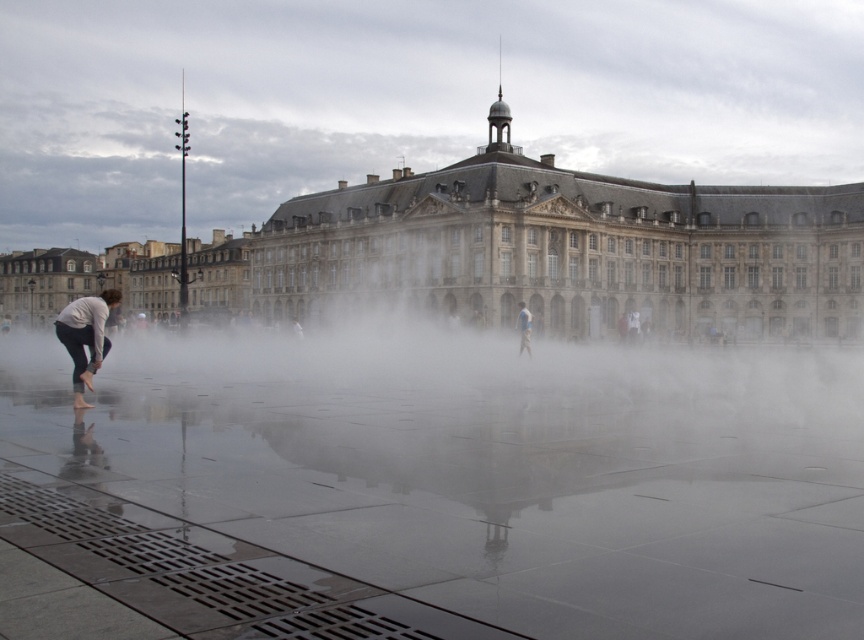
Which of these two, stone building at center or white fabric person at center, stands shorter?

With less height is white fabric person at center.

Does stone building at center appear on the right side of white fabric person at center?

Incorrect, stone building at center is not on the right side of white fabric person at center.

Which is behind, point (810, 198) or point (530, 352)?

Point (810, 198)

The height and width of the screenshot is (640, 864). I want to click on stone building at center, so click(528, 250).

Measure the distance between light gray fabric pants at lower left and white fabric person at center.

The distance of light gray fabric pants at lower left from white fabric person at center is 31.26 meters.

Measure the distance between point (87, 326) and camera.

45.49 meters

Does point (94, 365) come farther from viewer compared to point (523, 324)?

No.

This screenshot has height=640, width=864. Identify the location of light gray fabric pants at lower left. (86, 337).

Who is taller, stone building at center or light gray fabric pants at lower left?

Standing taller between the two is stone building at center.

Can you confirm if stone building at center is shorter than light gray fabric pants at lower left?

Incorrect, stone building at center's height does not fall short of light gray fabric pants at lower left's.

Locate an element on the screen. The height and width of the screenshot is (640, 864). stone building at center is located at coordinates (528, 250).